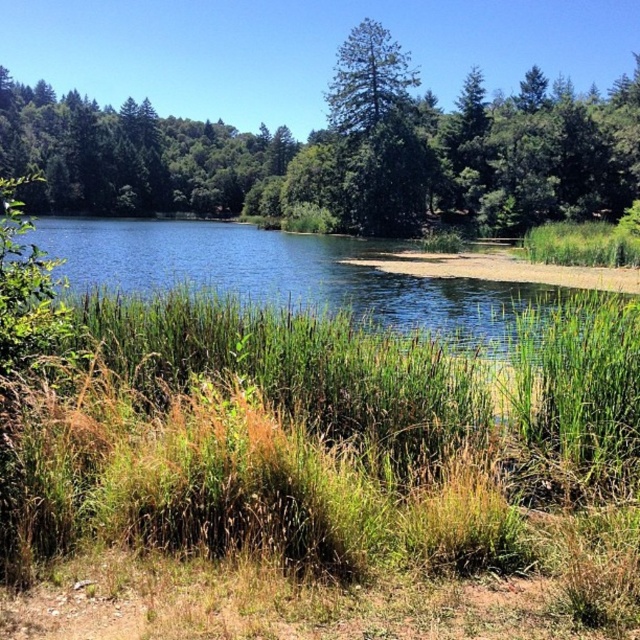
Does point (582, 536) come behind point (236, 157)?

No, (582, 536) is closer to viewer.

Does point (163, 596) come closer to viewer compared to point (593, 180)?

That is True.

Find the location of `green grassy at lower center`. green grassy at lower center is located at coordinates (324, 460).

Which of these two, green grassy at lower center or blue water at center, stands taller?

blue water at center

How far apart are green grassy at lower center and blue water at center?

green grassy at lower center is 11.29 meters away from blue water at center.

This screenshot has width=640, height=640. What do you see at coordinates (324, 460) in the screenshot?
I see `green grassy at lower center` at bounding box center [324, 460].

Find the location of a particular element. The width and height of the screenshot is (640, 640). green grassy at lower center is located at coordinates point(324,460).

Is green textured tree at center to the left of blue water at center from the viewer's perspective?

Yes, green textured tree at center is to the left of blue water at center.

Is green textured tree at center positioned behind blue water at center?

Yes, green textured tree at center is further from the viewer.

Locate an element on the screen. This screenshot has width=640, height=640. green textured tree at center is located at coordinates (340, 150).

In order to click on green textured tree at center in this screenshot , I will do `click(340, 150)`.